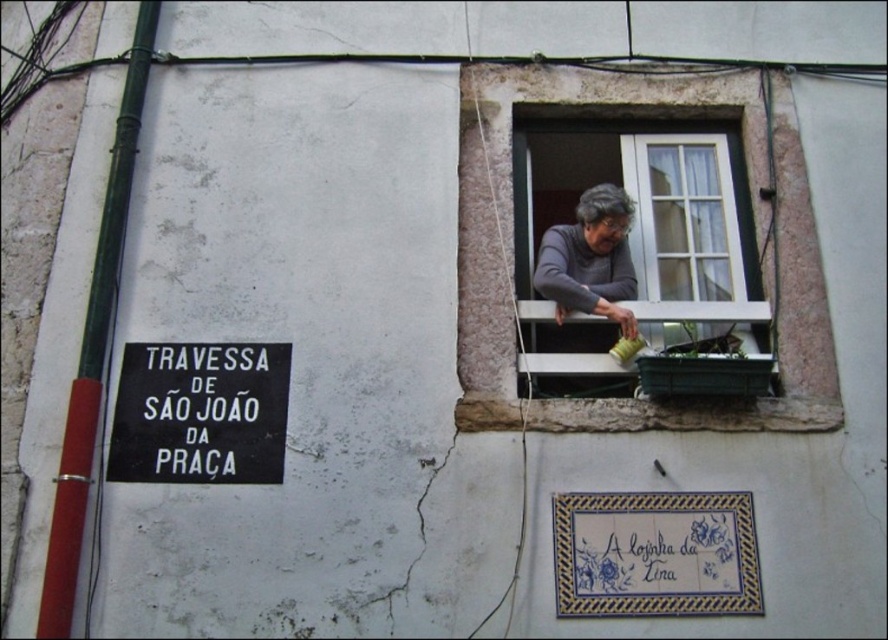
Can you confirm if black matte sign at lower left is wider than gray fabric at window?

Correct, the width of black matte sign at lower left exceeds that of gray fabric at window.

In the scene shown: Which of these two, black matte sign at lower left or gray fabric at window, stands taller?

gray fabric at window

Is point (204, 483) positioned in front of point (599, 243)?

Yes.

The image size is (888, 640). Identify the location of black matte sign at lower left. (200, 413).

Does point (657, 300) come farther from viewer compared to point (560, 282)?

Yes, it is behind point (560, 282).

Is white wooden window at upper right above gray fabric at window?

Yes, white wooden window at upper right is above gray fabric at window.

This screenshot has height=640, width=888. Describe the element at coordinates (655, 212) in the screenshot. I see `white wooden window at upper right` at that location.

You are a GUI agent. You are given a task and a screenshot of the screen. Output one action in this format:
    pyautogui.click(x=<x>, y=<y>)
    Task: Click on the white wooden window at upper right
    Image resolution: width=888 pixels, height=640 pixels.
    Given the screenshot: What is the action you would take?
    pyautogui.click(x=655, y=212)

Does white wooden window at upper right appear on the left side of black matte sign at lower left?

Incorrect, white wooden window at upper right is not on the left side of black matte sign at lower left.

Who is positioned more to the right, white wooden window at upper right or black matte sign at lower left?

white wooden window at upper right is more to the right.

Where is `white wooden window at upper right`? This screenshot has width=888, height=640. white wooden window at upper right is located at coordinates (655, 212).